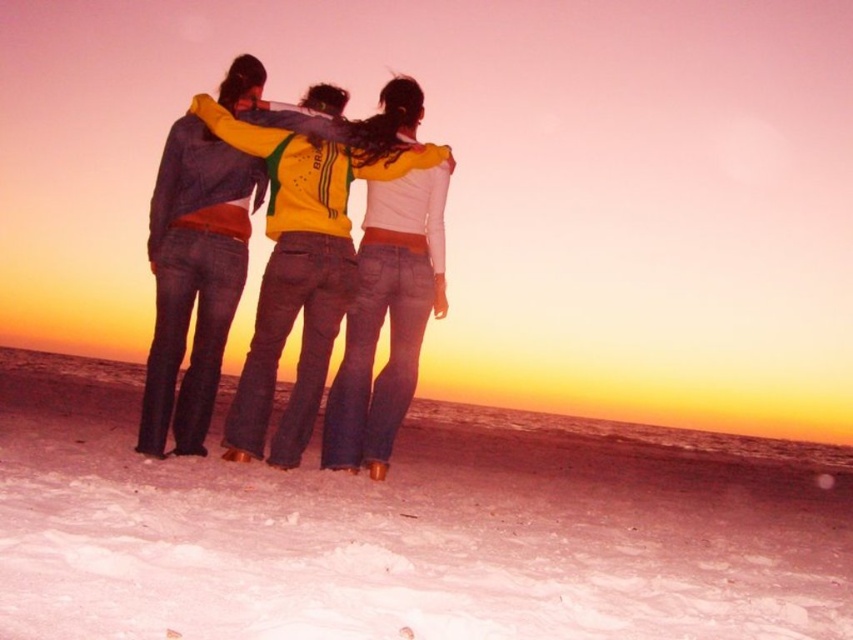
Who is higher up, denim jacket at center or yellow-green jersey at center?

denim jacket at center is higher up.

Is denim jacket at center positioned before yellow-green jersey at center?

Yes, it is.

Does point (281, 461) come in front of point (346, 401)?

Yes.

Find the location of `denim jacket at center`. denim jacket at center is located at coordinates (245, 260).

Is white powdery snow at center below yellow-green jersey at center?

Yes, white powdery snow at center is below yellow-green jersey at center.

Is white powdery snow at center to the right of yellow-green jersey at center from the viewer's perspective?

Incorrect, white powdery snow at center is not on the right side of yellow-green jersey at center.

Where is `white powdery snow at center`? This screenshot has height=640, width=853. white powdery snow at center is located at coordinates (410, 529).

Who is more distant from viewer, (492,442) or (173,253)?

Point (492,442)

Locate an element on the screen. The width and height of the screenshot is (853, 640). white powdery snow at center is located at coordinates (410, 529).